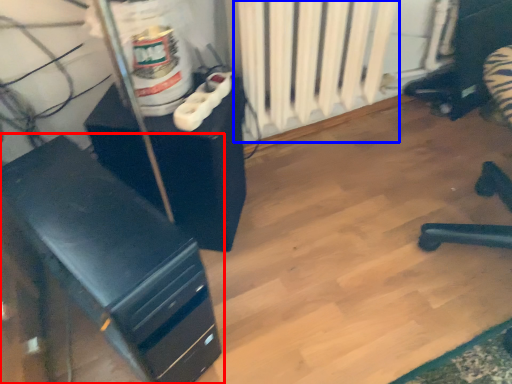
Question: Which object appears closest to the camera in this image, furniture (highlighted by a red box) or radiator (highlighted by a blue box)?

Choices:
 (A) furniture
 (B) radiator

Answer: (A)